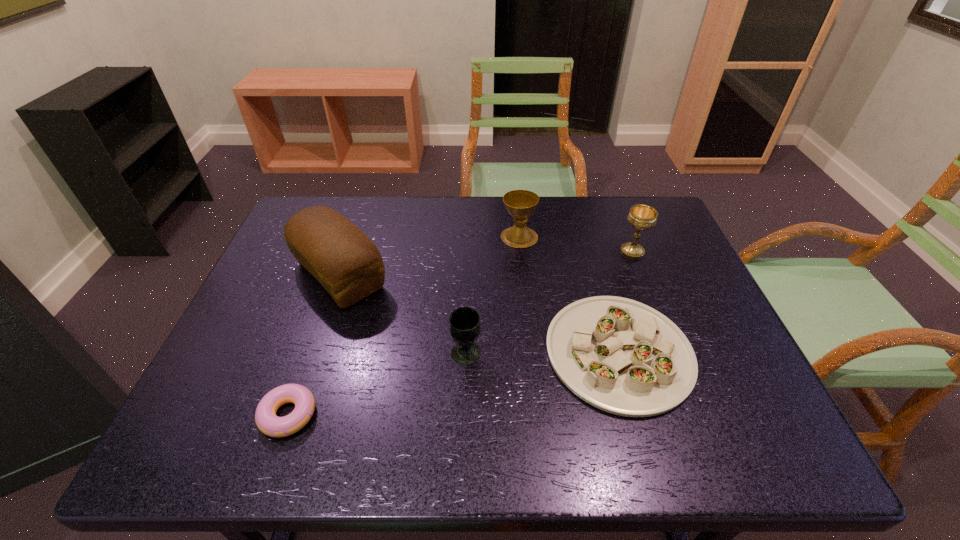
Where is `vacant space located 0.350m on the back of the third object from left to right`? The height and width of the screenshot is (540, 960). vacant space located 0.350m on the back of the third object from left to right is located at coordinates (469, 247).

What are the coordinates of `free space located on the back of the platter` in the screenshot? It's located at (585, 234).

Where is `vacant space situated on the right of the shortest object`? The height and width of the screenshot is (540, 960). vacant space situated on the right of the shortest object is located at coordinates (375, 415).

The image size is (960, 540). In order to click on object present at the far edge in this screenshot , I will do `click(520, 204)`.

You are a GUI agent. You are given a task and a screenshot of the screen. Output one action in this format:
    pyautogui.click(x=<x>, y=<y>)
    Task: Click on the platter that is at the near edge
    
    Given the screenshot: What is the action you would take?
    pyautogui.click(x=621, y=356)

Locate an element on the screen. doughnut that is at the near edge is located at coordinates (268, 423).

Identify the location of bread located at the left edge. The width and height of the screenshot is (960, 540). (349, 266).

Identify the location of doughnut located at the left edge. (268, 423).

Find the location of a particular element. The width and height of the screenshot is (960, 540). chalice at the right edge is located at coordinates (643, 217).

This screenshot has width=960, height=540. In order to click on platter that is positioned at the right edge in this screenshot , I will do `click(621, 356)`.